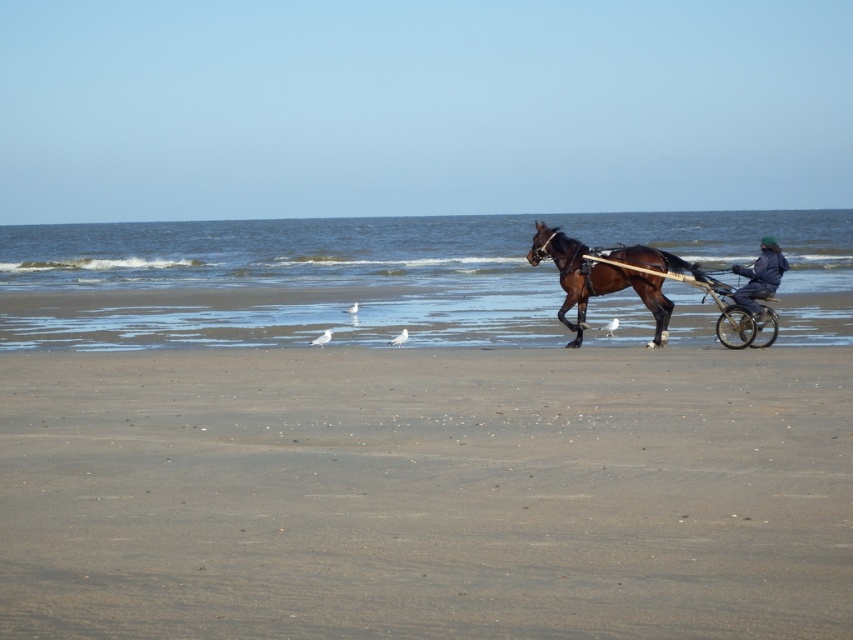
Can you confirm if smooth sand beach at center is thinner than brown glossy horse at center?

Incorrect, smooth sand beach at center's width is not less than brown glossy horse at center's.

Who is more distant from viewer, (44, 570) or (561, 244)?

Point (561, 244)

Locate an element on the screen. This screenshot has width=853, height=640. smooth sand beach at center is located at coordinates pos(427,492).

Between smooth sand beach at center and wooden cart at center, which one appears on the right side from the viewer's perspective?

wooden cart at center is more to the right.

Between point (659, 605) and point (735, 314), which one is positioned behind?

The point (735, 314) is behind.

Who is more distant from viewer, (338, 560) or (744, 324)?

Point (744, 324)

Where is `smooth sand beach at center`? This screenshot has height=640, width=853. smooth sand beach at center is located at coordinates (427, 492).

Does smooth sand beach at center have a lesser width compared to dark blue fabric jacket at center?

No.

Is the position of smooth sand beach at center less distant than that of dark blue fabric jacket at center?

Yes.

Is point (45, 589) closer to viewer compared to point (766, 257)?

Yes, point (45, 589) is closer to viewer.

Identify the location of smooth sand beach at center. 427,492.